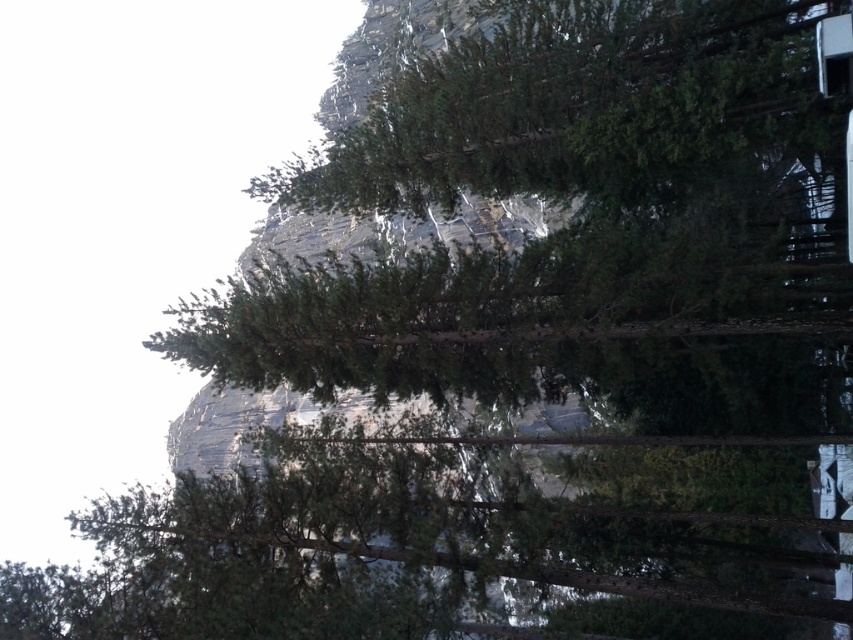
You are sitting inside a train and looking out the transparent glass train window at upper right. You notice a green matte tree at upper center outside. Can you determine if the tree is taller than the window?

The green matte tree at upper center is much taller than the transparent glass train window at upper right, so yes, the tree is taller than the window.

You are a passenger on a train and looking out the window. You see a green matte tree at upper center and a transparent glass train window at upper right. Which object is closer to the left side of your view?

The green matte tree at upper center is closer to the left side of your view because it is positioned to the left of the transparent glass train window at upper right.

You are standing in a forest looking at the scene. Where is the green matte tree at upper center located in terms of coordinates?

The green matte tree at upper center is located at coordinates point [572,104].